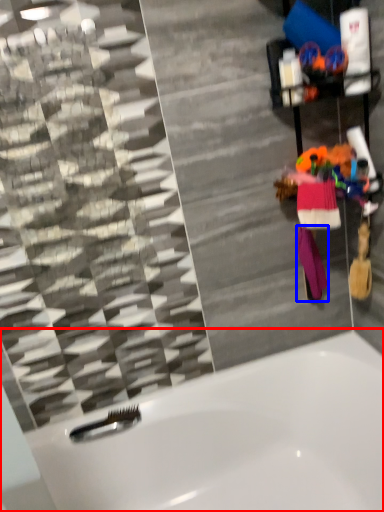
Question: Among these objects, which one is farthest to the camera, bathtub (highlighted by a red box) or clothing (highlighted by a blue box)?

Choices:
 (A) bathtub
 (B) clothing

Answer: (B)